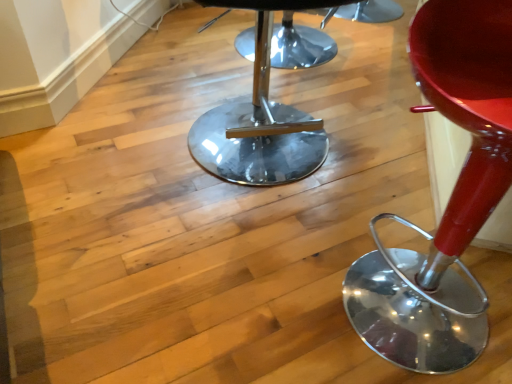
Question: From a real-world perspective, relative to glossy red stool at right, is polished chrome stool at center vertically above or below?

Choices:
 (A) above
 (B) below

Answer: (B)

Question: Visually, is polished chrome stool at center positioned to the left or to the right of glossy red stool at right?

Choices:
 (A) right
 (B) left

Answer: (B)

Question: Is polished chrome stool at center situated inside glossy red stool at right or outside?

Choices:
 (A) inside
 (B) outside

Answer: (B)

Question: Relative to polished chrome stool at center, is glossy red stool at right in front or behind?

Choices:
 (A) behind
 (B) front

Answer: (B)

Question: From a real-world perspective, is glossy red stool at right physically located above or below polished chrome stool at center?

Choices:
 (A) above
 (B) below

Answer: (A)

Question: Visually, is glossy red stool at right positioned to the left or to the right of polished chrome stool at center?

Choices:
 (A) right
 (B) left

Answer: (A)

Question: Considering the positions of glossy red stool at right and polished chrome stool at center in the image, is glossy red stool at right bigger or smaller than polished chrome stool at center?

Choices:
 (A) small
 (B) big

Answer: (A)